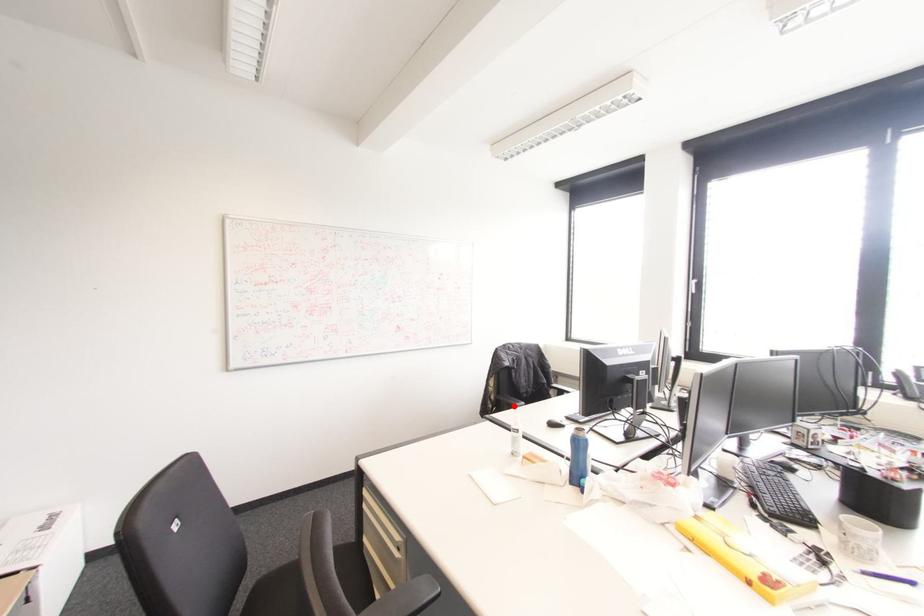
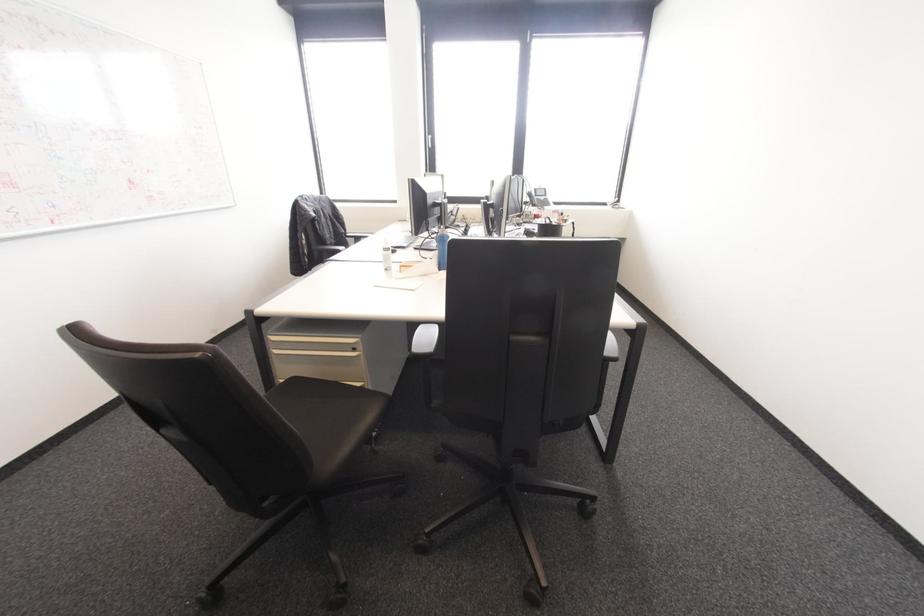
Find the pixel in the second image that matches the highlighted location in the first image.

(337, 251)